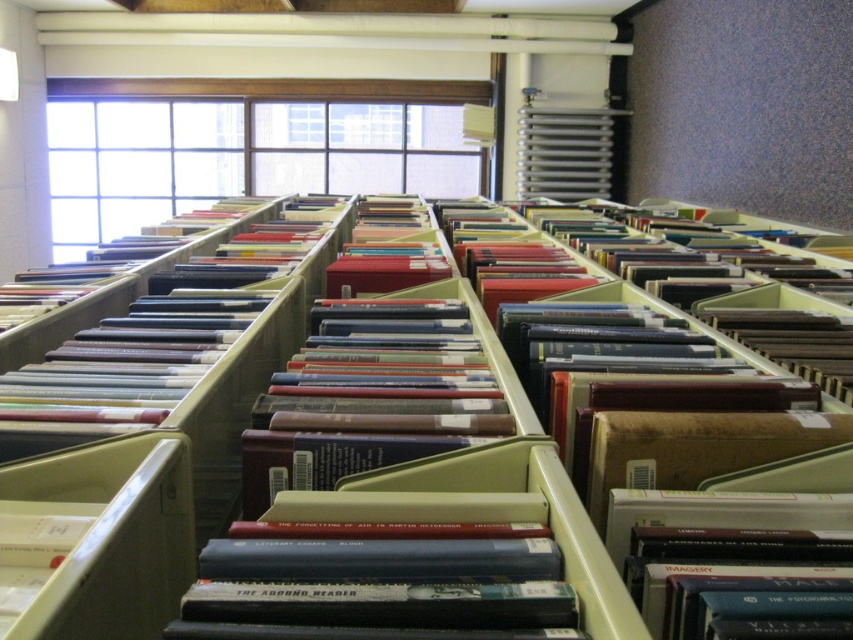
Question: Which object is farther from the camera taking this photo?

Choices:
 (A) brown matte folder at center
 (B) matte plastic bookshelf at center

Answer: (A)

Question: Is matte plastic bookshelf at center bigger than brown matte folder at center?

Choices:
 (A) yes
 (B) no

Answer: (A)

Question: Which point is farther to the camera?

Choices:
 (A) (335, 472)
 (B) (343, 468)

Answer: (A)

Question: Can you confirm if matte plastic bookshelf at center is wider than brown matte folder at center?

Choices:
 (A) no
 (B) yes

Answer: (B)

Question: Is matte plastic bookshelf at center wider than brown matte folder at center?

Choices:
 (A) no
 (B) yes

Answer: (B)